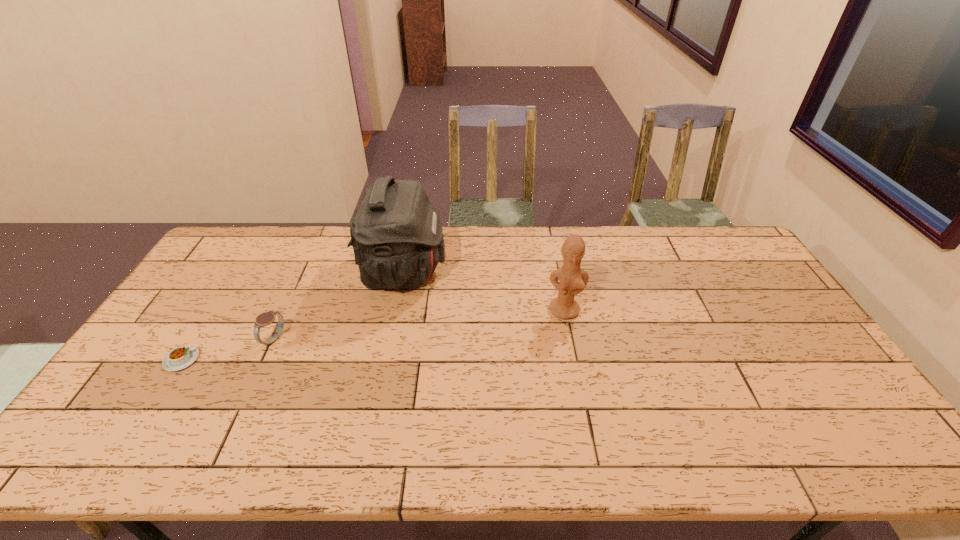
I want to click on vacant region located on the right of the third object from right to left, so click(x=301, y=339).

This screenshot has height=540, width=960. I want to click on vacant space located 0.350m on the right of the leftmost object, so click(325, 359).

The image size is (960, 540). Find the location of `object positioned at the far edge`. object positioned at the far edge is located at coordinates (397, 237).

Locate an element on the screen. This screenshot has height=540, width=960. object that is at the left edge is located at coordinates pos(181,357).

In the image, there is a desktop. Identify the location of vacant space at the far edge. The height and width of the screenshot is (540, 960). (282, 238).

This screenshot has height=540, width=960. I want to click on blank space at the near edge of the desktop, so click(x=451, y=433).

Where is `free location at the right edge of the desktop`? This screenshot has width=960, height=540. free location at the right edge of the desktop is located at coordinates (771, 295).

The width and height of the screenshot is (960, 540). In order to click on free area in between the second object from left to right and the third object from left to right in this screenshot , I will do `click(339, 306)`.

You are a GUI agent. You are given a task and a screenshot of the screen. Output one action in this format:
    pyautogui.click(x=<x>, y=<y>)
    Task: Click on the vacant point located between the rightmost object and the shortest object
    
    Given the screenshot: What is the action you would take?
    pyautogui.click(x=373, y=335)

The height and width of the screenshot is (540, 960). I want to click on vacant point located between the pudding and the tallest object, so tap(293, 316).